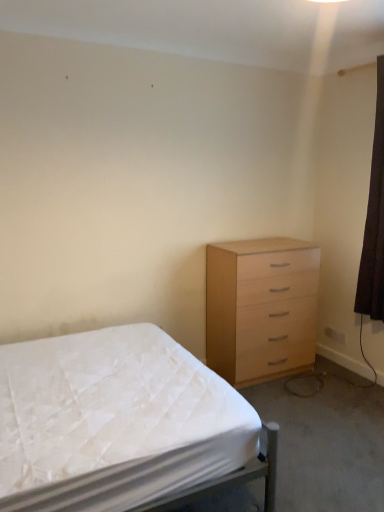
Where is `unoccupied area in front of light wood chest of drawers at right`? unoccupied area in front of light wood chest of drawers at right is located at coordinates coord(290,401).